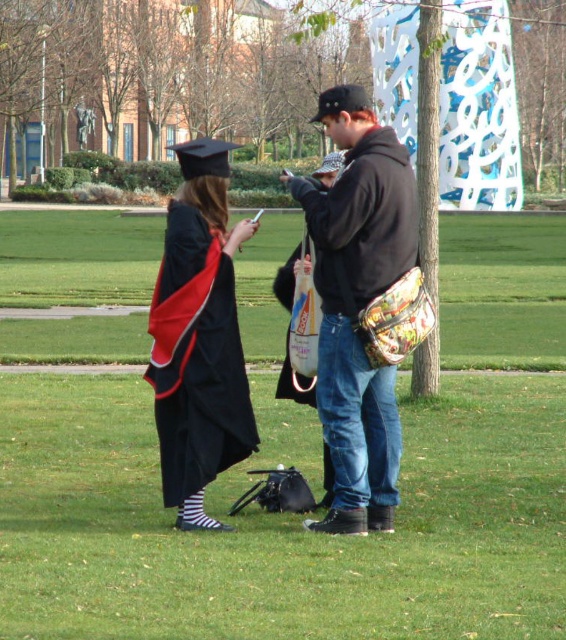
Does black fleece jacket at center appear on the right side of matte black graduation gown at center?

Correct, you'll find black fleece jacket at center to the right of matte black graduation gown at center.

Which is behind, point (346, 228) or point (212, 157)?

Positioned behind is point (212, 157).

This screenshot has height=640, width=566. Find the location of `black fleece jacket at center`. black fleece jacket at center is located at coordinates (362, 307).